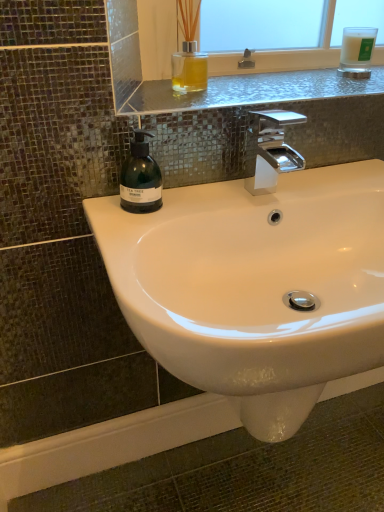
Question: In terms of width, does metallic glass shelf at upper center look wider or thinner when compared to polished chrome faucet at center?

Choices:
 (A) wide
 (B) thin

Answer: (A)

Question: Would you say metallic glass shelf at upper center is to the left or to the right of polished chrome faucet at center in the picture?

Choices:
 (A) left
 (B) right

Answer: (B)

Question: Which object is positioned closest to the white glossy sink at center?

Choices:
 (A) green matte soap dispenser at left
 (B) polished chrome faucet at center
 (C) white frosted glass candle at upper right
 (D) metallic glass shelf at upper center

Answer: (B)

Question: Which is farther from the metallic glass shelf at upper center?

Choices:
 (A) white frosted glass candle at upper right
 (B) polished chrome faucet at center
 (C) green matte soap dispenser at left
 (D) white glossy sink at center

Answer: (D)